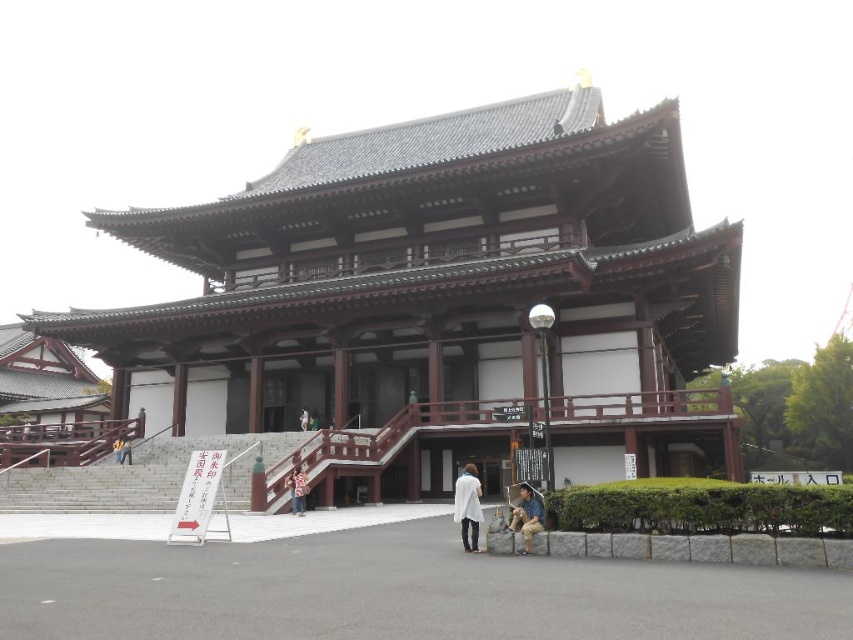
Question: Which object is the closest to the wooden bench at lower center?

Choices:
 (A) light brown wooden bench at center
 (B) brown wooden stairs at center

Answer: (A)

Question: Does wooden bench at lower center come behind white fabric bag at center?

Choices:
 (A) yes
 (B) no

Answer: (B)

Question: Can you confirm if brown wooden stairs at center is smaller than white fabric bag at center?

Choices:
 (A) no
 (B) yes

Answer: (A)

Question: Among these points, which one is farthest from the camera?

Choices:
 (A) (268, 445)
 (B) (459, 483)

Answer: (A)

Question: Based on their relative distances, which object is farther from the white fabric bag at center?

Choices:
 (A) light brown wooden bench at center
 (B) white matte coat at center

Answer: (B)

Question: Does white matte coat at center appear on the right side of light brown wooden bench at center?

Choices:
 (A) yes
 (B) no

Answer: (A)